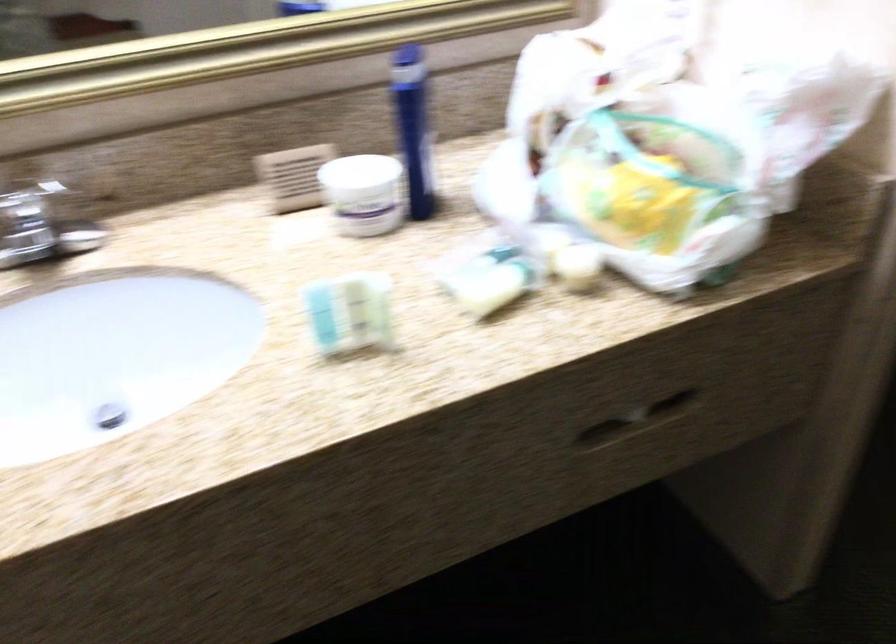
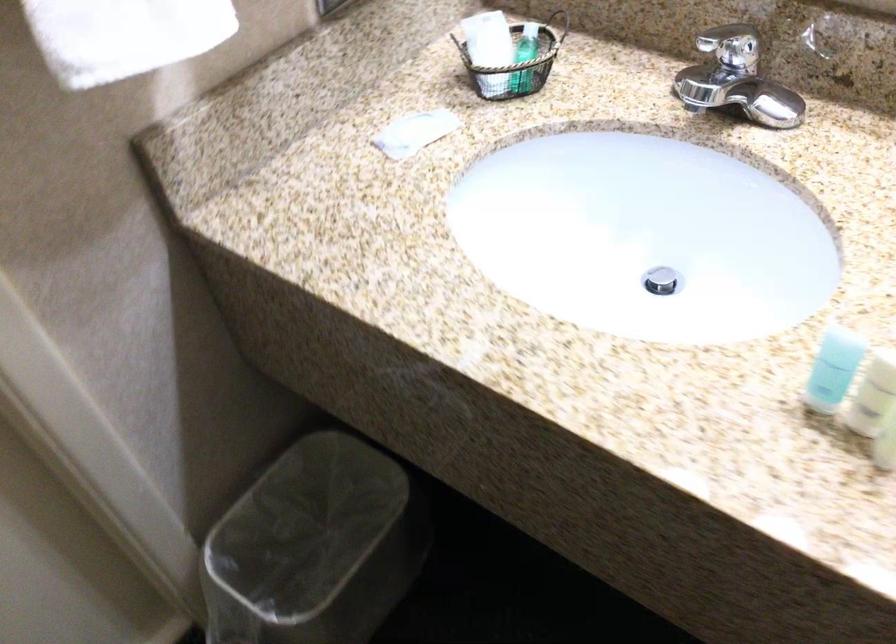
The point at (314, 315) is marked in the first image. Where is the corresponding point in the second image?

(833, 368)